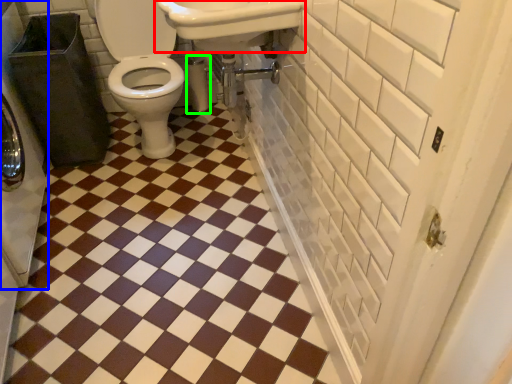
Question: Estimate the real-world distances between objects in this image. Which object is farther from sink (highlighted by a red box), washer (highlighted by a blue box) or toilet paper (highlighted by a green box)?

Choices:
 (A) washer
 (B) toilet paper

Answer: (A)